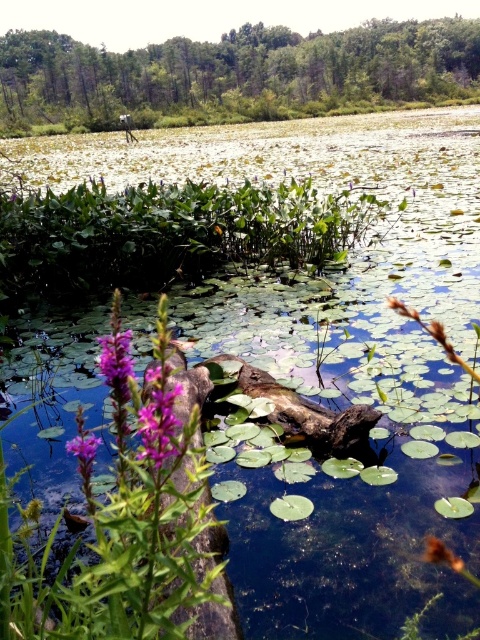
Question: Is purple matte flower at center-left smaller than purple matte flower at lower left?

Choices:
 (A) yes
 (B) no

Answer: (B)

Question: Which of the following is the farthest from the observer?

Choices:
 (A) purple matte flower at lower left
 (B) purple matte flower at center-left
 (C) green leafy tree at upper center

Answer: (C)

Question: Among these objects, which one is farthest from the camera?

Choices:
 (A) green leafy tree at upper center
 (B) purple matte flower at center-left

Answer: (A)

Question: Can you confirm if green leafy tree at upper center is thinner than purple matte flower at center-left?

Choices:
 (A) no
 (B) yes

Answer: (A)

Question: Can you confirm if purple matte flower at center-left is smaller than purple matte flower at lower left?

Choices:
 (A) no
 (B) yes

Answer: (A)

Question: Which point is farther to the camera?

Choices:
 (A) purple matte flower at center-left
 (B) purple matte flower at lower left

Answer: (B)